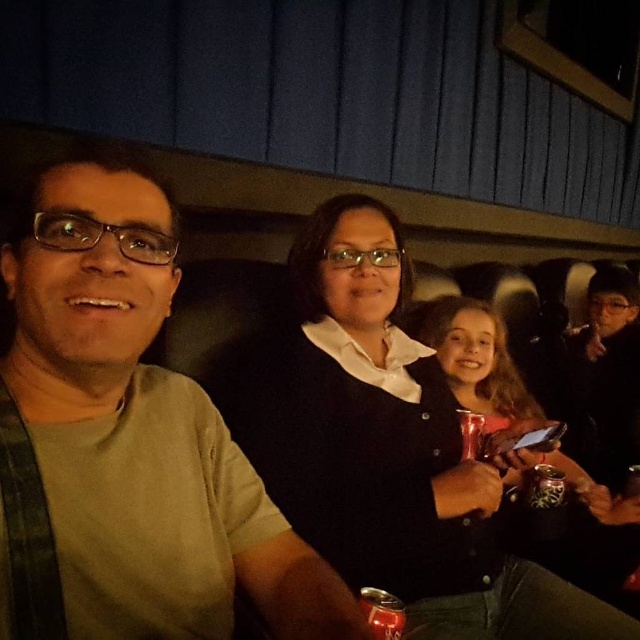
You are taking a photo of the matte green shirt at left and the black matte sweater at center. Which one is more to the left in the frame?

The matte green shirt at left is more to the left than the black matte sweater at center.

You are a photographer trying to capture a candid shot of both the matte green shirt at left and the black matte sweater at center in the movie theater scene. Since the chairs are slightly out of focus, you need to adjust your camera settings to ensure both subjects are in focus. Which object should you focus on first to achieve this?

The matte green shirt at left is shorter than the black matte sweater at center, so focusing on the black matte sweater at center first will ensure both are in focus as the shorter object will naturally fall into the depth of field when focusing on the farther one.

You are a photographer taking a picture of the two people in the scene. You want to focus on the black matte sweater at center and the matte black shirt at center. Which object should you adjust your camera to focus on first if you want to capture the one closer to the left side?

The black matte sweater at center is to the left of matte black shirt at center, so you should focus on the black matte sweater at center first since it is closer to the left side.